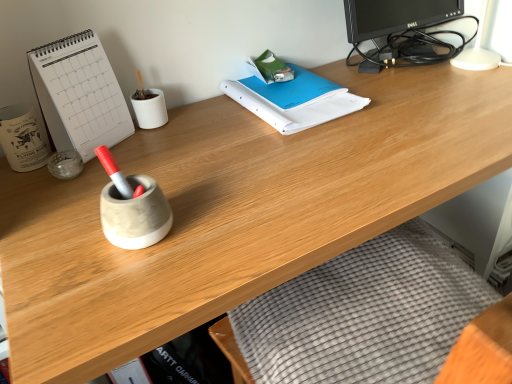
You are a GUI agent. You are given a task and a screenshot of the screen. Output one action in this format:
    pyautogui.click(x=<x>, y=<y>)
    Task: Click on the free location in front of black glossy monitor at upper right
    
    Given the screenshot: What is the action you would take?
    pyautogui.click(x=434, y=108)